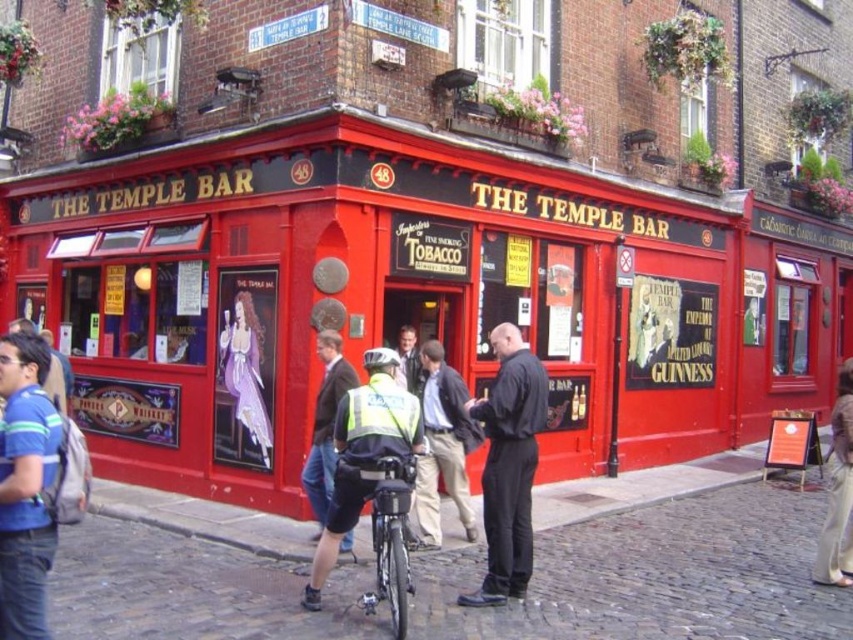
You are a photographer standing in front of The Temple Bar pub. You notice a blue striped shirt at lower left and a black matte suit at center. Which clothing item is closer to the camera?

The blue striped shirt at lower left is shorter than the black matte suit at center, so it appears closer to the camera.

You are a photographer trying to capture a closeup of the Guinness poster on the window. You notice two people in the scene wearing dark blue jeans at center and reflective yellow vest at center. Which of their clothing items would block your view more if they stand between you and the window?

The dark blue jeans at center would block your view more because its width is larger than the reflective yellow vest at center.

You are standing at the point closest to the pub entrance. There are two points marked in the image, one at coordinates point (463, 420) and another at point (318, 515). Which of these points is farther away from your current position?

Point (463, 420) is behind point (318, 515), so the point farther away from your current position is point (463, 420).